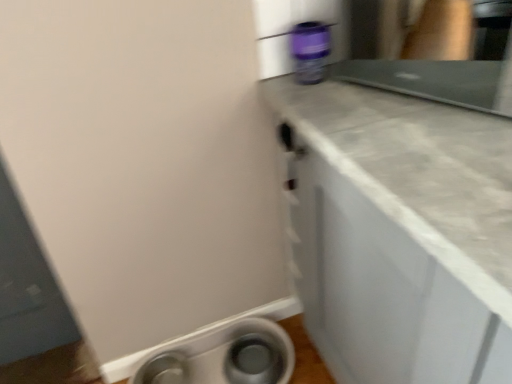
Measure the distance between point (178, 381) and camera.

They are 4.74 feet apart.

In order to face satin white dishwasher at lower left, should I rotate leftwards or rightwards?

Rotate left and turn 5.303 degrees.

At what (x,y) coordinates should I click in order to perform the action: click on satin white dishwasher at lower left. Please return your answer as a coordinate pair (x, y). This screenshot has height=384, width=512. Looking at the image, I should click on (225, 357).

What do you see at coordinates (225, 357) in the screenshot? I see `satin white dishwasher at lower left` at bounding box center [225, 357].

You are a GUI agent. You are given a task and a screenshot of the screen. Output one action in this format:
    pyautogui.click(x=<x>, y=<y>)
    Task: Click on the satin white dishwasher at lower left
    The height and width of the screenshot is (384, 512).
    Given the screenshot: What is the action you would take?
    pyautogui.click(x=225, y=357)